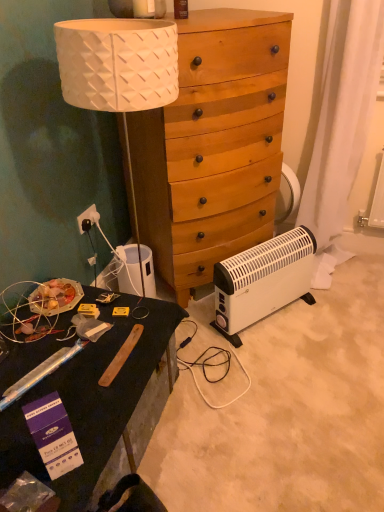
You are a GUI agent. You are given a task and a screenshot of the screen. Output one action in this format:
    pyautogui.click(x=<x>, y=<y>)
    Task: Click on the free spot above black matte desk at lower left (from a real-world perspective)
    
    Given the screenshot: What is the action you would take?
    pyautogui.click(x=78, y=356)